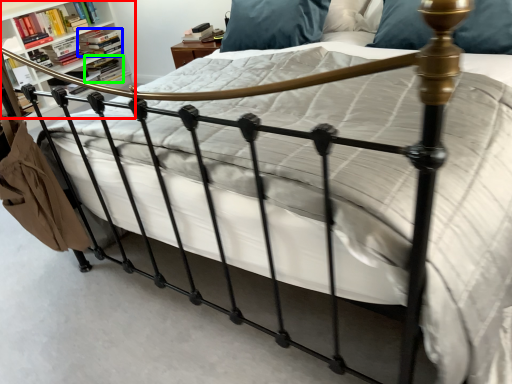
Question: Which is nearer to the shelf (highlighted by a red box)? book (highlighted by a blue box) or book (highlighted by a green box).

Choices:
 (A) book
 (B) book

Answer: (A)